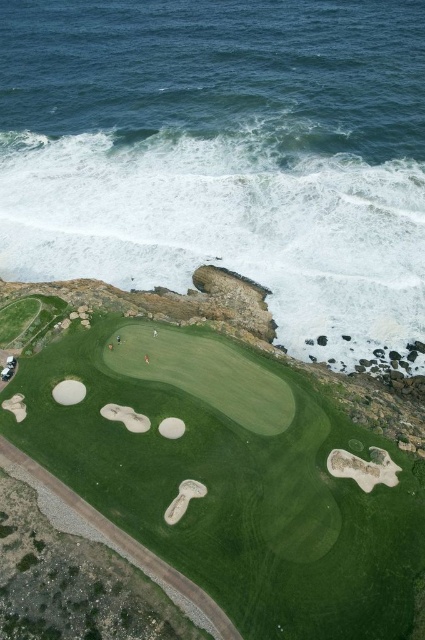
Which is below, white foamy wave at upper center or white sand bunker at lower left?

Positioned lower is white sand bunker at lower left.

Looking at this image, who is more forward, (249, 268) or (56, 394)?

Point (56, 394)

Is point (326, 205) positioned before point (65, 396)?

No, (326, 205) is behind (65, 396).

What are the coordinates of `white foamy wave at upper center` in the screenshot? It's located at (227, 221).

Is green grassy golf course at center shorter than white foamy wave at upper center?

Yes, green grassy golf course at center is shorter than white foamy wave at upper center.

In the scene shown: Measure the distance between green grassy golf course at center and white foamy wave at upper center.

A distance of 125.13 feet exists between green grassy golf course at center and white foamy wave at upper center.

Where is `green grassy golf course at center`? This screenshot has height=640, width=425. green grassy golf course at center is located at coordinates (231, 477).

Which of these two, green grassy golf course at center or white sand bunker at lower left, stands shorter?

white sand bunker at lower left

I want to click on green grassy golf course at center, so click(231, 477).

Locate an element on the screen. green grassy golf course at center is located at coordinates (231, 477).